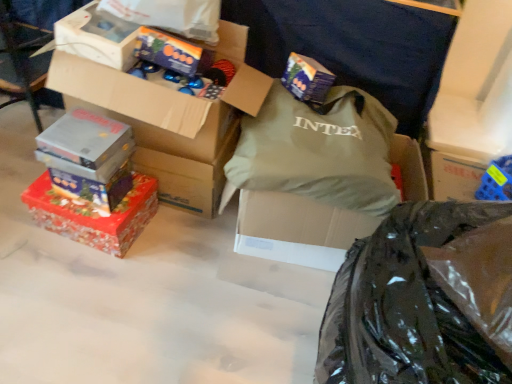
Where is `vacant space to the right of shiny red wrapping paper at lower left, the 1th box when ordered from left to right`? Image resolution: width=512 pixels, height=384 pixels. vacant space to the right of shiny red wrapping paper at lower left, the 1th box when ordered from left to right is located at coordinates (173, 245).